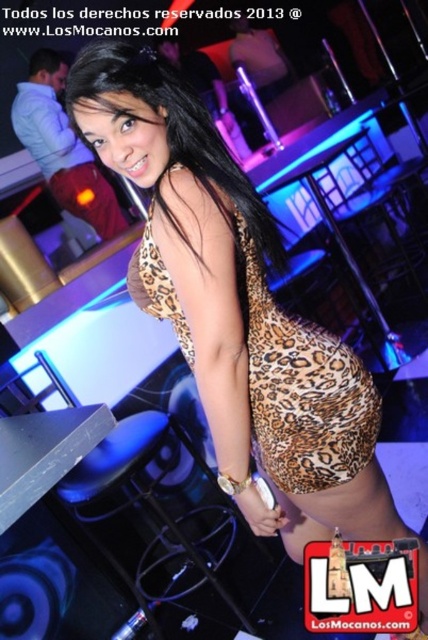
Question: Which object appears closest to the camera in this image?

Choices:
 (A) leopard print dress at center
 (B) matte black bartender at upper left

Answer: (A)

Question: Among these objects, which one is farthest from the camera?

Choices:
 (A) matte black bartender at upper left
 (B) leopard print dress at center

Answer: (A)

Question: Can you confirm if leopard print dress at center is positioned below matte black bartender at upper left?

Choices:
 (A) yes
 (B) no

Answer: (A)

Question: Is leopard print dress at center behind matte black bartender at upper left?

Choices:
 (A) no
 (B) yes

Answer: (A)

Question: Is leopard print dress at center above matte black bartender at upper left?

Choices:
 (A) yes
 (B) no

Answer: (B)